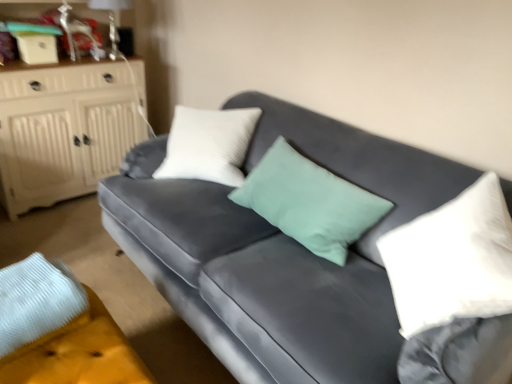
Question: In terms of width, does velvet gray couch at center look wider or thinner when compared to velvet yellow footrest at lower left?

Choices:
 (A) wide
 (B) thin

Answer: (A)

Question: From their relative heights in the image, would you say velvet gray couch at center is taller or shorter than velvet yellow footrest at lower left?

Choices:
 (A) tall
 (B) short

Answer: (A)

Question: Based on their relative distances, which object is nearer to the white soft pillow at right?

Choices:
 (A) white wood cabinet at left
 (B) velvet yellow footrest at lower left
 (C) velvet gray couch at center

Answer: (C)

Question: Considering the real-world distances, which object is closest to the velvet gray couch at center?

Choices:
 (A) white wood cabinet at left
 (B) velvet yellow footrest at lower left
 (C) white soft pillow at right

Answer: (C)